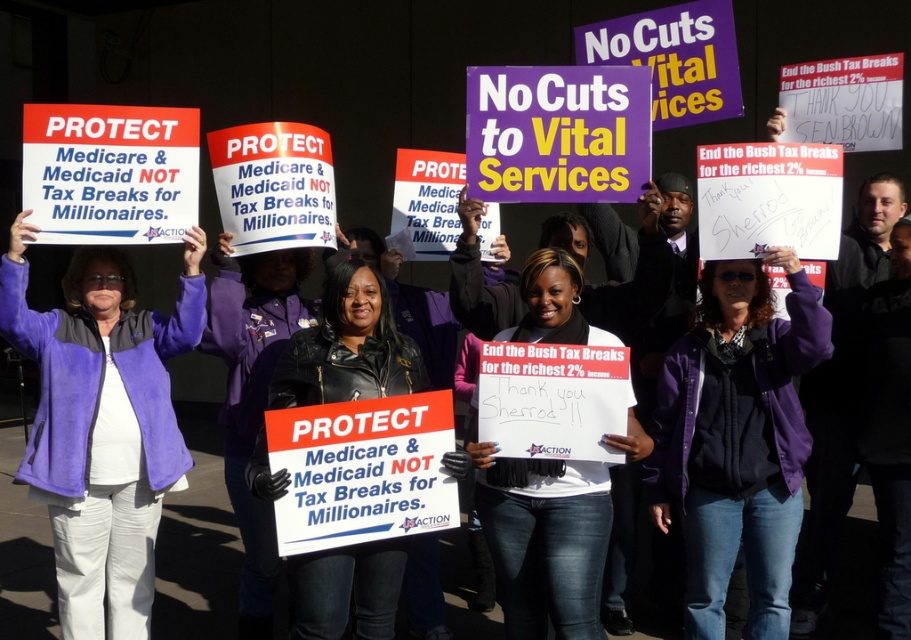
You are a photographer at the protest and want to capture both the purple fleece jacket at left and the matte purple jacket at center in a single photo. Which jacket should you position closer to the camera to ensure both are fully visible in the frame?

To ensure both the purple fleece jacket at left and the matte purple jacket at center are fully visible in the frame, position the purple fleece jacket at left closer to the camera since it is much taller than the matte purple jacket at center. This way, the taller jacket won

You are a photographer at the protest and want to capture a photo that includes both the purple fleece jacket at left and the matte purple jacket at center. Which jacket should you position to the left side of your frame to include both?

To include both the purple fleece jacket at left and the matte purple jacket at center in the photo, position the purple fleece jacket at left to the left side of your frame since it is already to the left of the matte purple jacket at center in the scene.

You are a photographer at the protest. You want to take a photo that includes both the white matte sign at center and the matte purple jacket at center. Based on their positions, which object should you adjust to ensure both are fully visible in the frame?

The white matte sign at center is positioned on the right side of matte purple jacket at center. To ensure both are fully visible, you should adjust the matte purple jacket at center to move it slightly to the left or the white matte sign at center to move it slightly to the right so they don not overlap in the frame.